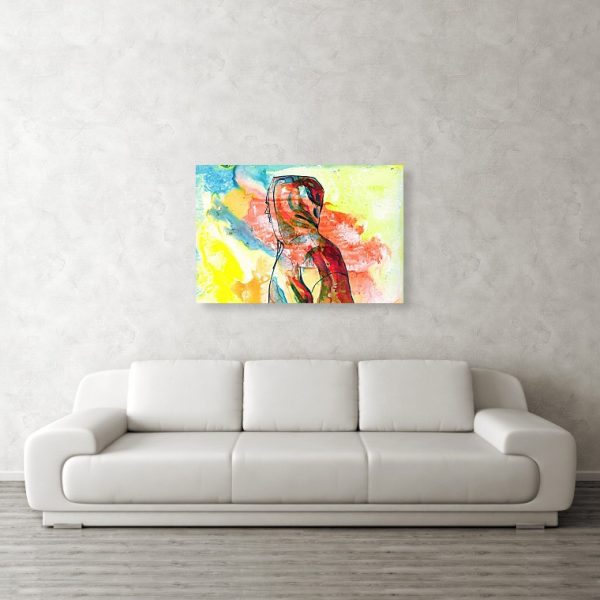
Identify the location of floor. (302, 591).